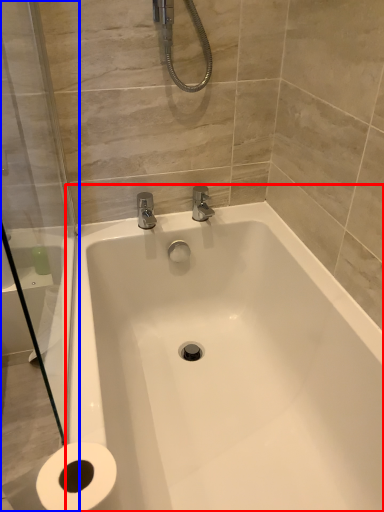
Question: Which object is closer to the camera taking this photo, bathtub (highlighted by a red box) or shower door (highlighted by a blue box)?

Choices:
 (A) bathtub
 (B) shower door

Answer: (B)